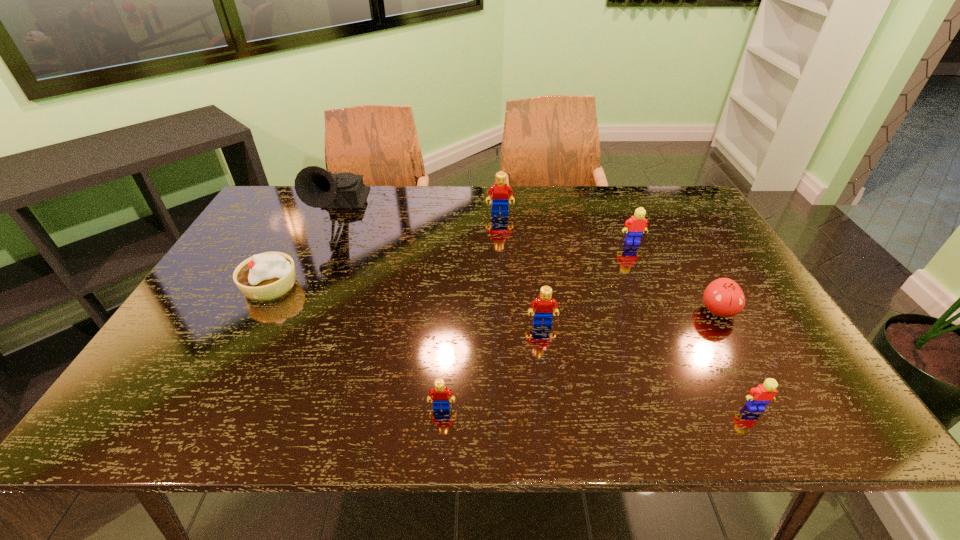
Where is `phonograph_record`? Image resolution: width=960 pixels, height=540 pixels. phonograph_record is located at coordinates (316, 187).

Find the location of a particular element. black phonograph_record is located at coordinates (316, 187).

At what (x,y) coordinates should I click in order to perform the action: click on the second red Lego from left to right. Please return your answer as a coordinate pair (x, y). Looking at the image, I should click on pyautogui.click(x=499, y=191).

What are the coordinates of `the biggest red Lego` in the screenshot? It's located at (499, 191).

Where is `the fourth nearest Lego`? The image size is (960, 540). the fourth nearest Lego is located at coordinates (636, 225).

The height and width of the screenshot is (540, 960). In order to click on the fourth Lego from left to right in this screenshot , I will do `click(636, 225)`.

This screenshot has height=540, width=960. I want to click on the third Lego from left to right, so (x=544, y=304).

Locate an element on the screen. The height and width of the screenshot is (540, 960). the second smallest red Lego is located at coordinates (544, 304).

Identify the location of whipped cream. The height and width of the screenshot is (540, 960). (266, 276).

You are a GUI agent. You are given a task and a screenshot of the screen. Output one action in this format:
    pyautogui.click(x=<x>, y=<y>)
    Task: Click on the apple
    The image size is (960, 540).
    Given the screenshot: What is the action you would take?
    pyautogui.click(x=723, y=297)